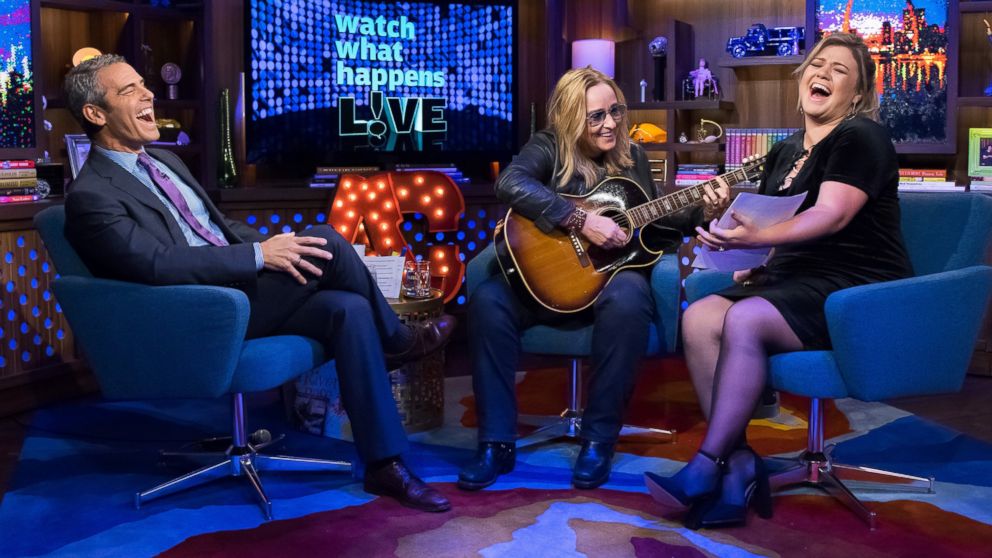
What are the coordinates of `wall` in the screenshot? It's located at (757, 100), (215, 42).